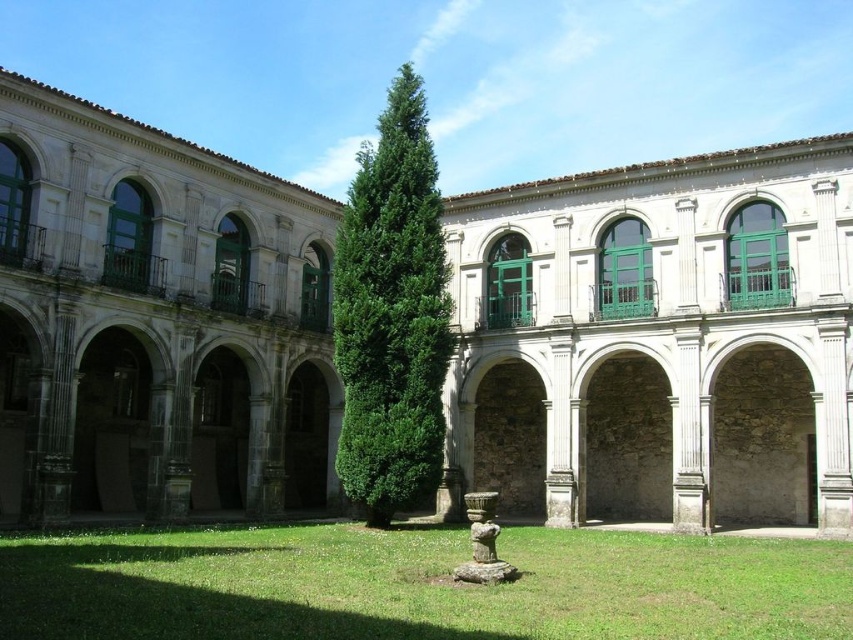
Consider the image. Is stone arches at center wider than green grass at center?

Yes.

Can you confirm if stone arches at center is taller than green grass at center?

Yes, stone arches at center is taller than green grass at center.

Is point (640, 422) positioned in front of point (38, 616)?

No, (640, 422) is behind (38, 616).

I want to click on stone arches at center, so click(x=657, y=340).

Measure the distance between green grass at center and camera.

A distance of 26.41 meters exists between green grass at center and camera.

Measure the distance between point (654, 580) and camera.

A distance of 122.41 feet exists between point (654, 580) and camera.

Where is `green grass at center`? Image resolution: width=853 pixels, height=640 pixels. green grass at center is located at coordinates (418, 586).

Is stone arches at center positioned before green leafy tree at center?

Yes, it is in front of green leafy tree at center.

Is point (148, 433) farther from viewer compared to point (387, 376)?

Yes.

Is point (793, 164) positioned behind point (421, 312)?

That is False.

This screenshot has height=640, width=853. What are the coordinates of `stone arches at center` in the screenshot? It's located at (657, 340).